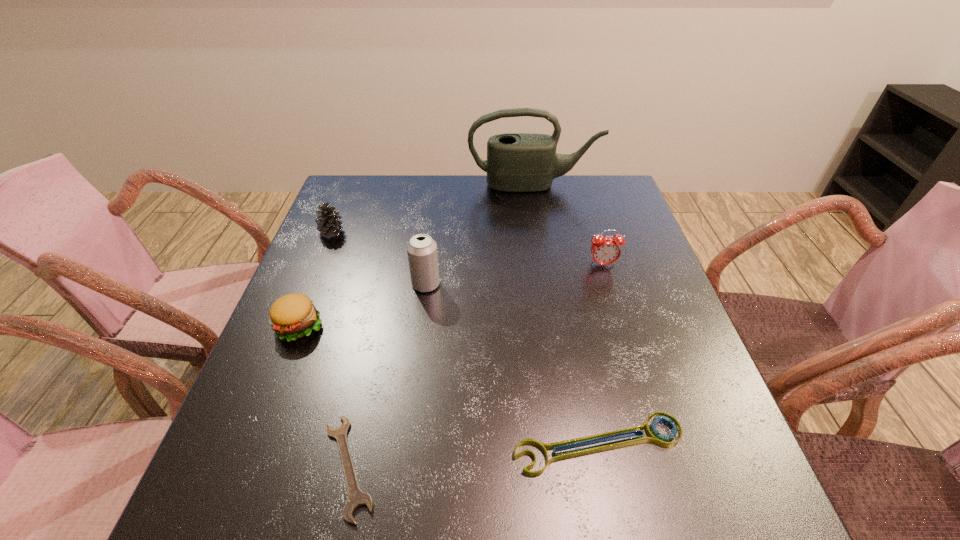
In order to click on free space at the right edge of the desktop in this screenshot , I will do `click(656, 340)`.

Find the location of `vacant area at the far left corner`. vacant area at the far left corner is located at coordinates (371, 208).

In the image, there is a desktop. At what (x,y) coordinates should I click in order to perform the action: click on free space at the far right corner. Please return your answer as a coordinate pair (x, y). Looking at the image, I should click on (611, 179).

Where is `free space between the fourth object from right to left and the sixth tallest object`? free space between the fourth object from right to left and the sixth tallest object is located at coordinates (513, 364).

You are a GUI agent. You are given a task and a screenshot of the screen. Output one action in this format:
    pyautogui.click(x=<x>, y=<y>)
    Task: Click on the empty space between the beer can and the fifth farthest object
    This screenshot has width=960, height=540.
    Given the screenshot: What is the action you would take?
    pyautogui.click(x=363, y=305)

Image resolution: width=960 pixels, height=540 pixels. Identify the location of vacant space that's between the sixth shortest object and the third farthest object. (515, 274).

Image resolution: width=960 pixels, height=540 pixels. I want to click on free space between the second farthest object and the hamburger, so click(316, 279).

The height and width of the screenshot is (540, 960). I want to click on vacant area that lies between the second farthest object and the hamburger, so click(x=316, y=279).

Locate an element on the screen. This screenshot has width=960, height=540. free spot between the sixth nearest object and the shortest object is located at coordinates (340, 349).

This screenshot has width=960, height=540. What are the coordinates of `vacant space that's between the fifth nearest object and the third nearest object` in the screenshot? It's located at (451, 295).